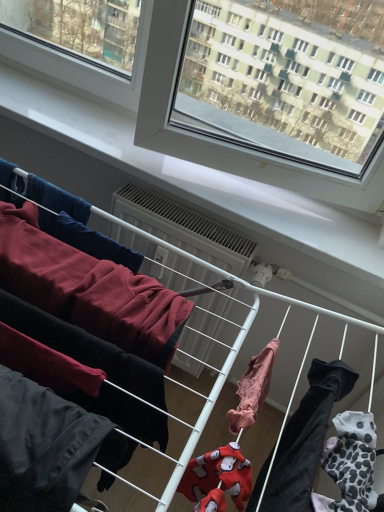
Question: Is white plastic air conditioner at center oriented away from light pink fabric at center, arranged as the third clothing when viewed from the left?

Choices:
 (A) yes
 (B) no

Answer: (B)

Question: Does white plastic air conditioner at center have a lesser height compared to light pink fabric at center, the first clothing viewed from the right?

Choices:
 (A) yes
 (B) no

Answer: (B)

Question: Is white plastic air conditioner at center positioned beyond the bounds of light pink fabric at center, arranged as the third clothing when viewed from the left?

Choices:
 (A) yes
 (B) no

Answer: (A)

Question: Can you confirm if white plastic air conditioner at center is taller than light pink fabric at center, the first clothing viewed from the right?

Choices:
 (A) no
 (B) yes

Answer: (B)

Question: From a real-world perspective, is white plastic air conditioner at center positioned under light pink fabric at center, arranged as the third clothing when viewed from the left, based on gravity?

Choices:
 (A) yes
 (B) no

Answer: (A)

Question: In terms of size, does dark gray cotton pants at lower left, the first clothing from the left, appear bigger or smaller than white plastic air conditioner at center?

Choices:
 (A) small
 (B) big

Answer: (A)

Question: From their relative heights in the image, would you say dark gray cotton pants at lower left, the first clothing from the left, is taller or shorter than white plastic air conditioner at center?

Choices:
 (A) tall
 (B) short

Answer: (A)

Question: Considering the relative positions of dark gray cotton pants at lower left, the first clothing from the left, and white plastic air conditioner at center in the image provided, is dark gray cotton pants at lower left, the first clothing from the left, to the left or to the right of white plastic air conditioner at center?

Choices:
 (A) left
 (B) right

Answer: (A)

Question: Choose the correct answer: Is dark gray cotton pants at lower left, the first clothing from the left, inside white plastic air conditioner at center or outside it?

Choices:
 (A) inside
 (B) outside

Answer: (B)

Question: Is dark red fleece sweatshirt at left, arranged as the second clothing when viewed from the left, to the left or to the right of white plastic air conditioner at center in the image?

Choices:
 (A) left
 (B) right

Answer: (A)

Question: Is dark red fleece sweatshirt at left, which is the 2th clothing in right-to-left order, in front of or behind white plastic air conditioner at center in the image?

Choices:
 (A) front
 (B) behind

Answer: (A)

Question: From the image's perspective, is dark red fleece sweatshirt at left, which is the 2th clothing in right-to-left order, above or below white plastic air conditioner at center?

Choices:
 (A) above
 (B) below

Answer: (B)

Question: From a real-world perspective, is dark red fleece sweatshirt at left, arranged as the second clothing when viewed from the left, above or below white plastic air conditioner at center?

Choices:
 (A) below
 (B) above

Answer: (B)

Question: Considering the positions of light pink fabric at center, the first clothing viewed from the right, and dark gray cotton pants at lower left, the first clothing from the left, in the image, is light pink fabric at center, the first clothing viewed from the right, taller or shorter than dark gray cotton pants at lower left, the first clothing from the left,?

Choices:
 (A) short
 (B) tall

Answer: (A)

Question: Considering the relative positions of light pink fabric at center, the first clothing viewed from the right, and dark gray cotton pants at lower left, positioned as the third clothing in right-to-left order, in the image provided, is light pink fabric at center, the first clothing viewed from the right, to the left or to the right of dark gray cotton pants at lower left, positioned as the third clothing in right-to-left order,?

Choices:
 (A) left
 (B) right

Answer: (B)